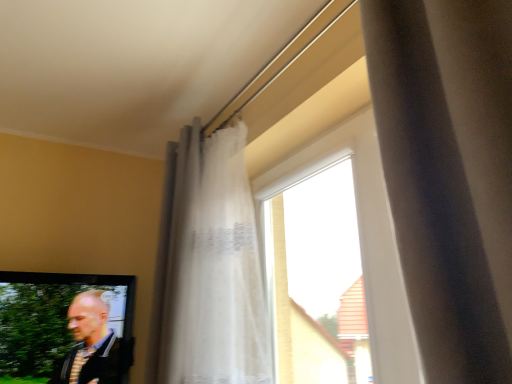
Question: Is white sheer curtain at upper center located outside striped fabric shirt at lower left?

Choices:
 (A) no
 (B) yes

Answer: (B)

Question: From the image's perspective, is white sheer curtain at upper center located above striped fabric shirt at lower left?

Choices:
 (A) yes
 (B) no

Answer: (A)

Question: Considering the relative sizes of white sheer curtain at upper center and striped fabric shirt at lower left in the image provided, is white sheer curtain at upper center wider than striped fabric shirt at lower left?

Choices:
 (A) yes
 (B) no

Answer: (A)

Question: Is white sheer curtain at upper center further to camera compared to striped fabric shirt at lower left?

Choices:
 (A) yes
 (B) no

Answer: (B)

Question: Is white sheer curtain at upper center aimed at striped fabric shirt at lower left?

Choices:
 (A) yes
 (B) no

Answer: (B)

Question: Is white sheer curtain at upper center smaller than striped fabric shirt at lower left?

Choices:
 (A) yes
 (B) no

Answer: (B)

Question: Is striped fabric shirt at lower left smaller than transparent glass window at center?

Choices:
 (A) no
 (B) yes

Answer: (A)

Question: Is striped fabric shirt at lower left further to camera compared to transparent glass window at center?

Choices:
 (A) no
 (B) yes

Answer: (B)

Question: Considering the relative sizes of striped fabric shirt at lower left and transparent glass window at center in the image provided, is striped fabric shirt at lower left wider than transparent glass window at center?

Choices:
 (A) no
 (B) yes

Answer: (B)

Question: Does striped fabric shirt at lower left appear on the left side of transparent glass window at center?

Choices:
 (A) yes
 (B) no

Answer: (A)

Question: Is striped fabric shirt at lower left facing away from transparent glass window at center?

Choices:
 (A) no
 (B) yes

Answer: (A)

Question: Considering the relative sizes of striped fabric shirt at lower left and transparent glass window at center in the image provided, is striped fabric shirt at lower left bigger than transparent glass window at center?

Choices:
 (A) no
 (B) yes

Answer: (B)

Question: Does transparent glass window at center have a larger size compared to white sheer curtain at upper center?

Choices:
 (A) yes
 (B) no

Answer: (B)